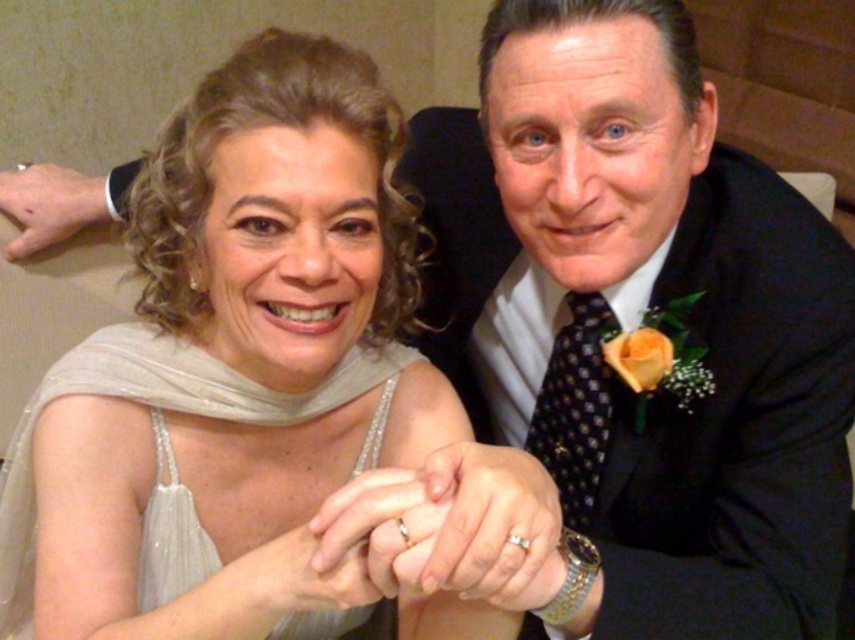
Question: Which point is farther to the camera?

Choices:
 (A) satin white dress at center
 (B) black satin suit at upper right

Answer: (A)

Question: Which of the following is the closest to the observer?

Choices:
 (A) black satin suit at upper right
 (B) satin white dress at center

Answer: (A)

Question: Does black satin suit at upper right have a lesser width compared to satin white dress at center?

Choices:
 (A) yes
 (B) no

Answer: (A)

Question: Among these points, which one is farthest from the camera?

Choices:
 (A) (228, 536)
 (B) (705, 560)

Answer: (A)

Question: Is black satin suit at upper right positioned before satin white dress at center?

Choices:
 (A) yes
 (B) no

Answer: (A)

Question: Is black satin suit at upper right wider than satin white dress at center?

Choices:
 (A) yes
 (B) no

Answer: (B)